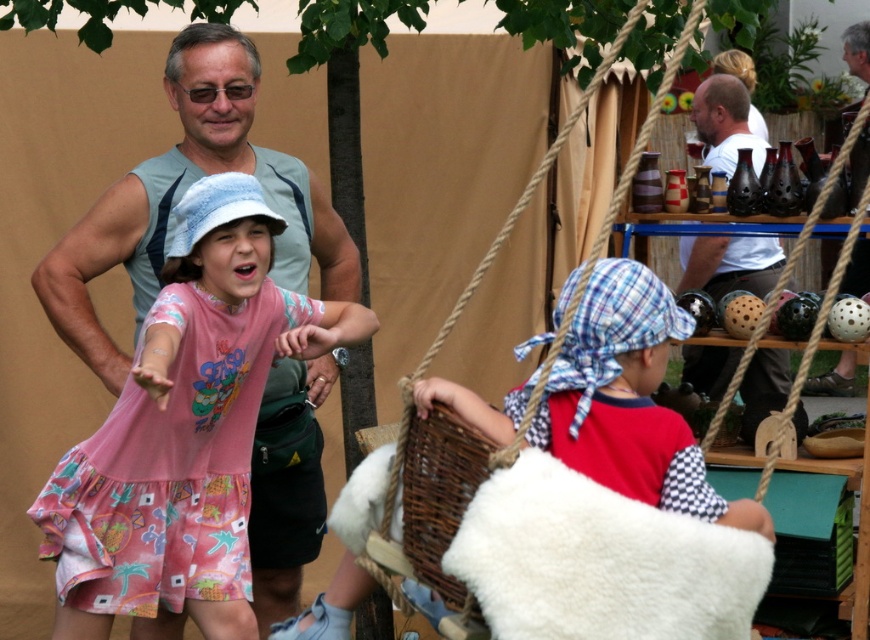
You are a photographer trying to capture a photo of the white cotton shirt at upper right and the woven brown basket at lower center. Which object is wider?

The white cotton shirt at upper right is wider than the woven brown basket at lower center.

You are a photographer trying to capture a clear shot of both the white cotton shirt at upper right and the woven brown basket at lower center. Since you want both subjects in focus, which one should you focus on first to ensure depth of field?

You should focus on the white cotton shirt at upper right first because it is closer to the camera than the woven brown basket at lower center, allowing the background subject to remain in focus.